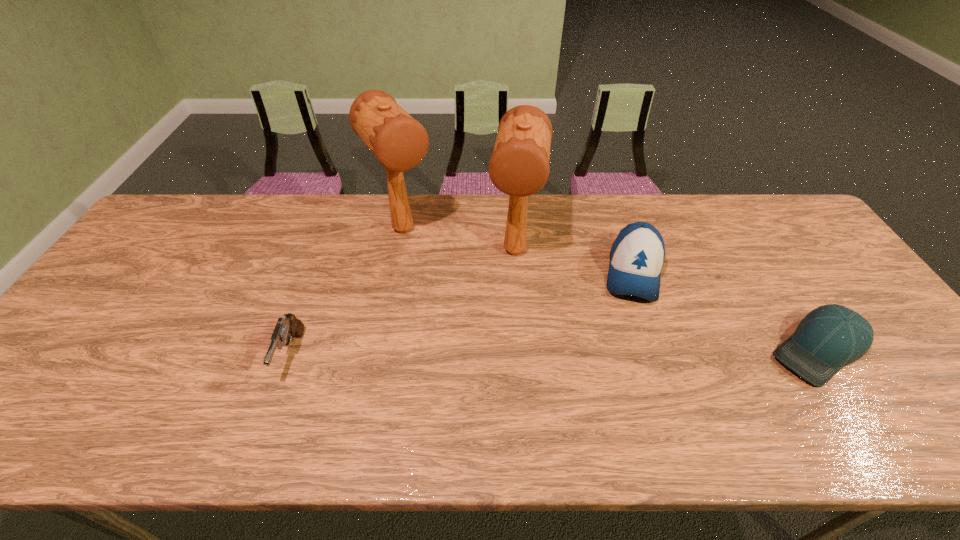
Locate an element on the screen. object present at the right edge is located at coordinates (828, 338).

Where is `object at the near right corner`? The image size is (960, 540). object at the near right corner is located at coordinates [828, 338].

The height and width of the screenshot is (540, 960). I want to click on blank space at the far edge of the desktop, so click(391, 240).

Where is `free region at the near edge of the desktop`? The height and width of the screenshot is (540, 960). free region at the near edge of the desktop is located at coordinates (356, 383).

What are the coordinates of `vacant area at the left edge of the desktop` in the screenshot? It's located at (128, 316).

At what (x,y) coordinates should I click in order to perform the action: click on free space at the right edge of the desktop. Please return your answer as a coordinate pair (x, y). Looking at the image, I should click on (914, 359).

This screenshot has height=540, width=960. What are the coordinates of `vacant region at the far left corner of the desktop` in the screenshot? It's located at (156, 236).

Where is `free space at the far right corner`? This screenshot has width=960, height=540. free space at the far right corner is located at coordinates (760, 210).

The image size is (960, 540). Identify the location of empty location between the shorter baseball cap and the second shortest object. (555, 353).

Where is `free area in between the right mallet and the rightmost object`? The height and width of the screenshot is (540, 960). free area in between the right mallet and the rightmost object is located at coordinates (666, 301).